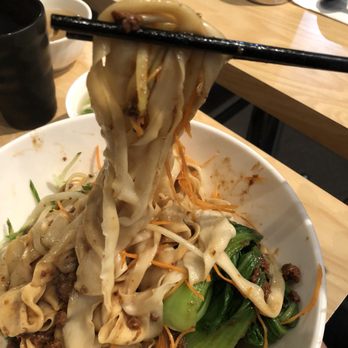
Where is `eating utensil`? The height and width of the screenshot is (348, 348). eating utensil is located at coordinates (270, 52).